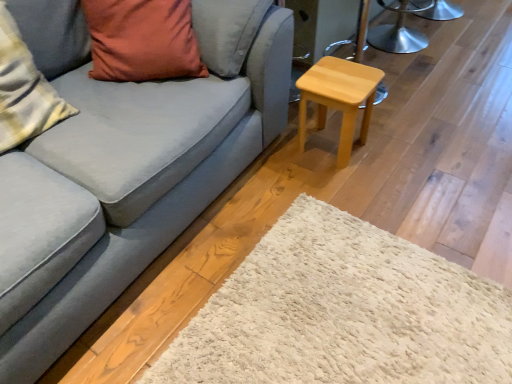
Question: Is point click(393, 34) positioned closer to the camera than point click(8, 23)?

Choices:
 (A) farther
 (B) closer

Answer: (A)

Question: Is metallic silver stool at upper right taller or shorter than plush cotton pillow at left, arranged as the second pillow when viewed from the right?

Choices:
 (A) tall
 (B) short

Answer: (B)

Question: Which of these objects is positioned farthest from the metallic silver stool at upper right?

Choices:
 (A) matte gray couch at center
 (B) matte orange pillow at upper left, the first pillow in the right-to-left sequence
 (C) light wood/stained stool at right
 (D) plush cotton pillow at left, arranged as the second pillow when viewed from the right

Answer: (D)

Question: Which object is positioned farthest from the matte gray couch at center?

Choices:
 (A) plush cotton pillow at left, which appears as the 1th pillow when viewed from the left
 (B) light wood/stained stool at right
 (C) matte orange pillow at upper left, which is counted as the second pillow, starting from the left
 (D) metallic silver stool at upper right

Answer: (D)